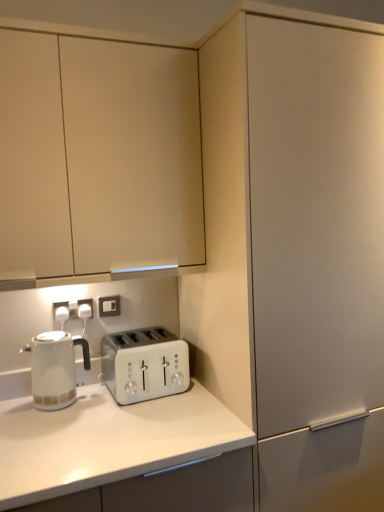
What do you see at coordinates (306, 246) in the screenshot? I see `matte white cabinet at center, placed as the second cabinetry when sorted from left to right` at bounding box center [306, 246].

The image size is (384, 512). What do you see at coordinates (109, 306) in the screenshot?
I see `white plastic electric outlet at upper center, the 2th electric outlet viewed from the left` at bounding box center [109, 306].

Looking at this image, measure the distance between point (61, 309) and camera.

Point (61, 309) is 1.62 meters away from camera.

Describe the element at coordinates (98, 155) in the screenshot. This screenshot has width=384, height=512. I see `matte white cabinet at upper left, which is the 1th cabinetry from left to right` at that location.

What do you see at coordinates (144, 364) in the screenshot? The image size is (384, 512). I see `white plastic toaster at center` at bounding box center [144, 364].

You are a GUI agent. You are given a task and a screenshot of the screen. Output one action in this format:
    pyautogui.click(x=<x>, y=<y>)
    Task: Click on the white glossy kettle at left
    
    Given the screenshot: What is the action you would take?
    pyautogui.click(x=55, y=368)

In order to click on matte white cabinet at center, placed as the second cabinetry when sorted from left to right in this screenshot , I will do `click(306, 246)`.

From a real-world perspective, who is located higher, white plastic electric outlet at lower left, the second electric outlet in the back-to-front sequence, or white plastic electric outlet at upper center, acting as the first electric outlet starting from the right?

white plastic electric outlet at upper center, acting as the first electric outlet starting from the right.

Is white plastic electric outlet at lower left, acting as the 1th electric outlet starting from the front, aimed at white plastic electric outlet at upper center, marked as the 1th electric outlet in a back-to-front arrangement?

No, white plastic electric outlet at lower left, acting as the 1th electric outlet starting from the front, is not oriented towards white plastic electric outlet at upper center, marked as the 1th electric outlet in a back-to-front arrangement.

Based on their positions, is white plastic electric outlet at lower left, arranged as the 2th electric outlet when viewed from the right, located to the left or right of white plastic electric outlet at upper center, the second electric outlet in the front-to-back sequence?

Clearly, white plastic electric outlet at lower left, arranged as the 2th electric outlet when viewed from the right, is on the left of white plastic electric outlet at upper center, the second electric outlet in the front-to-back sequence, in the image.

Is white plastic electric outlet at lower left, the second electric outlet in the back-to-front sequence, in contact with white plastic electric outlet at upper center, the second electric outlet in the front-to-back sequence?

No, white plastic electric outlet at lower left, the second electric outlet in the back-to-front sequence, is not touching white plastic electric outlet at upper center, the second electric outlet in the front-to-back sequence.

Is white glossy kettle at left wider or thinner than white plastic electric outlet at upper center, the second electric outlet in the front-to-back sequence?

white glossy kettle at left is wider than white plastic electric outlet at upper center, the second electric outlet in the front-to-back sequence.

Considering the relative positions of white glossy kettle at left and white plastic electric outlet at upper center, the second electric outlet in the front-to-back sequence, in the image provided, is white glossy kettle at left to the left of white plastic electric outlet at upper center, the second electric outlet in the front-to-back sequence, from the viewer's perspective?

Yes.

How many degrees apart are the facing directions of white glossy kettle at left and white plastic electric outlet at upper center, acting as the first electric outlet starting from the right?

There is a 3.14-degree angle between the facing directions of white glossy kettle at left and white plastic electric outlet at upper center, acting as the first electric outlet starting from the right.

Considering the relative sizes of white glossy kettle at left and white plastic electric outlet at upper center, the 2th electric outlet viewed from the left, in the image provided, is white glossy kettle at left shorter than white plastic electric outlet at upper center, the 2th electric outlet viewed from the left,?

Incorrect, the height of white glossy kettle at left does not fall short of that of white plastic electric outlet at upper center, the 2th electric outlet viewed from the left.

Between white plastic electric outlet at upper center, the 2th electric outlet viewed from the left, and matte white cabinet at center, placed as the second cabinetry when sorted from left to right, which one has smaller size?

With smaller size is white plastic electric outlet at upper center, the 2th electric outlet viewed from the left.

Considering the sizes of objects white plastic electric outlet at upper center, marked as the 1th electric outlet in a back-to-front arrangement, and matte white cabinet at center, positioned as the 1th cabinetry in right-to-left order, in the image provided, who is taller, white plastic electric outlet at upper center, marked as the 1th electric outlet in a back-to-front arrangement, or matte white cabinet at center, positioned as the 1th cabinetry in right-to-left order,?

Standing taller between the two is matte white cabinet at center, positioned as the 1th cabinetry in right-to-left order.

From the image's perspective, is white plastic electric outlet at upper center, marked as the 1th electric outlet in a back-to-front arrangement, over matte white cabinet at center, positioned as the 1th cabinetry in right-to-left order?

Yes, from the image's perspective, white plastic electric outlet at upper center, marked as the 1th electric outlet in a back-to-front arrangement, is on top of matte white cabinet at center, positioned as the 1th cabinetry in right-to-left order.

From a real-world perspective, between white plastic electric outlet at upper center, the 2th electric outlet viewed from the left, and matte white cabinet at center, placed as the second cabinetry when sorted from left to right, who is vertically higher?

In real-world perspective, white plastic electric outlet at upper center, the 2th electric outlet viewed from the left, is above.

Are white plastic electric outlet at upper center, the second electric outlet in the front-to-back sequence, and white plastic electric outlet at lower left, placed as the first electric outlet when sorted from left to right, far apart?

white plastic electric outlet at upper center, the second electric outlet in the front-to-back sequence, is actually quite close to white plastic electric outlet at lower left, placed as the first electric outlet when sorted from left to right.

From a real-world perspective, which is physically below, white plastic electric outlet at upper center, acting as the first electric outlet starting from the right, or white plastic electric outlet at lower left, acting as the 1th electric outlet starting from the front?

From a 3D spatial view, white plastic electric outlet at lower left, acting as the 1th electric outlet starting from the front, is below.

I want to click on electric outlet above the white plastic electric outlet at lower left, placed as the first electric outlet when sorted from left to right (from a real-world perspective), so click(x=109, y=306).

Considering the positions of point (99, 311) and point (62, 309), is point (99, 311) closer or farther from the camera than point (62, 309)?

Point (99, 311).

In the scene shown: From a real-world perspective, does matte white cabinet at center, placed as the second cabinetry when sorted from left to right, sit lower than white plastic electric outlet at upper center, the 2th electric outlet viewed from the left?

Correct, in the physical world, matte white cabinet at center, placed as the second cabinetry when sorted from left to right, is lower than white plastic electric outlet at upper center, the 2th electric outlet viewed from the left.

How different are the orientations of matte white cabinet at center, placed as the second cabinetry when sorted from left to right, and white plastic electric outlet at upper center, acting as the first electric outlet starting from the right, in degrees?

There is a 4.32-degree angle between the facing directions of matte white cabinet at center, placed as the second cabinetry when sorted from left to right, and white plastic electric outlet at upper center, acting as the first electric outlet starting from the right.

Is matte white cabinet at center, placed as the second cabinetry when sorted from left to right, in contact with white plastic electric outlet at upper center, the second electric outlet in the front-to-back sequence?

No, matte white cabinet at center, placed as the second cabinetry when sorted from left to right, is not next to white plastic electric outlet at upper center, the second electric outlet in the front-to-back sequence.

Measure the distance from matte white cabinet at center, positioned as the 1th cabinetry in right-to-left order, to white plastic electric outlet at upper center, the second electric outlet in the front-to-back sequence.

34.02 inches.

Is matte white cabinet at upper left, which is the 1th cabinetry from left to right, positioned far away from white glossy kettle at left?

No, matte white cabinet at upper left, which is the 1th cabinetry from left to right, is not far from white glossy kettle at left.

Is matte white cabinet at upper left, the 2th cabinetry viewed from the right, not within white glossy kettle at left?

Yes.

How different are the orientations of matte white cabinet at upper left, the 2th cabinetry viewed from the right, and white glossy kettle at left in degrees?

0.945 degrees separate the facing orientations of matte white cabinet at upper left, the 2th cabinetry viewed from the right, and white glossy kettle at left.

Considering the relative sizes of matte white cabinet at upper left, which is the 1th cabinetry from left to right, and white glossy kettle at left in the image provided, is matte white cabinet at upper left, which is the 1th cabinetry from left to right, wider than white glossy kettle at left?

Correct, the width of matte white cabinet at upper left, which is the 1th cabinetry from left to right, exceeds that of white glossy kettle at left.

From a real-world perspective, is white plastic toaster at center positioned under matte white cabinet at center, placed as the second cabinetry when sorted from left to right, based on gravity?

Yes, from a real-world perspective, white plastic toaster at center is beneath matte white cabinet at center, placed as the second cabinetry when sorted from left to right.

Could matte white cabinet at center, placed as the second cabinetry when sorted from left to right, be considered to be inside white plastic toaster at center?

No, white plastic toaster at center does not contain matte white cabinet at center, placed as the second cabinetry when sorted from left to right.

Measure the distance between white plastic toaster at center and matte white cabinet at center, placed as the second cabinetry when sorted from left to right.

They are 23.53 inches apart.

Considering the sizes of objects white plastic toaster at center and matte white cabinet at center, placed as the second cabinetry when sorted from left to right, in the image provided, who is taller, white plastic toaster at center or matte white cabinet at center, placed as the second cabinetry when sorted from left to right,?

Standing taller between the two is matte white cabinet at center, placed as the second cabinetry when sorted from left to right.

Where is `electric outlet above the white plastic electric outlet at lower left, arranged as the 2th electric outlet when viewed from the right (from a real-world perspective)`? electric outlet above the white plastic electric outlet at lower left, arranged as the 2th electric outlet when viewed from the right (from a real-world perspective) is located at coordinates pos(109,306).

Locate an element on the screen. electric outlet on the right of white glossy kettle at left is located at coordinates (109, 306).

Which object lies further to the anchor point white plastic electric outlet at upper center, the 2th electric outlet viewed from the left, matte white cabinet at center, placed as the second cabinetry when sorted from left to right, or white plastic toaster at center?

matte white cabinet at center, placed as the second cabinetry when sorted from left to right.

Which object lies nearer to the anchor point white plastic toaster at center, matte white cabinet at upper left, which is the 1th cabinetry from left to right, or white plastic electric outlet at lower left, acting as the 1th electric outlet starting from the front?

white plastic electric outlet at lower left, acting as the 1th electric outlet starting from the front, is positioned closer to the anchor white plastic toaster at center.

Looking at the image, which one is located further to matte white cabinet at center, positioned as the 1th cabinetry in right-to-left order, white plastic toaster at center or white plastic electric outlet at lower left, the second electric outlet in the back-to-front sequence?

white plastic electric outlet at lower left, the second electric outlet in the back-to-front sequence, is further to matte white cabinet at center, positioned as the 1th cabinetry in right-to-left order.

When comparing their distances from matte white cabinet at upper left, which is the 1th cabinetry from left to right, does matte white cabinet at center, positioned as the 1th cabinetry in right-to-left order, or white plastic electric outlet at upper center, the 2th electric outlet viewed from the left, seem closer?

matte white cabinet at center, positioned as the 1th cabinetry in right-to-left order, is positioned closer to the anchor matte white cabinet at upper left, which is the 1th cabinetry from left to right.

Considering their positions, is white plastic electric outlet at upper center, the second electric outlet in the front-to-back sequence, positioned further to white glossy kettle at left than matte white cabinet at upper left, the 2th cabinetry viewed from the right?

Among the two, matte white cabinet at upper left, the 2th cabinetry viewed from the right, is located further to white glossy kettle at left.

Which object lies further to the anchor point white plastic electric outlet at lower left, arranged as the 2th electric outlet when viewed from the right, white glossy kettle at left or matte white cabinet at center, positioned as the 1th cabinetry in right-to-left order?

Among the two, matte white cabinet at center, positioned as the 1th cabinetry in right-to-left order, is located further to white plastic electric outlet at lower left, arranged as the 2th electric outlet when viewed from the right.

Considering their positions, is white plastic toaster at center positioned further to white glossy kettle at left than white plastic electric outlet at lower left, arranged as the 2th electric outlet when viewed from the right?

white plastic toaster at center is further to white glossy kettle at left.

Looking at this image, estimate the real-world distances between objects in this image. Which object is further from white plastic electric outlet at upper center, the 2th electric outlet viewed from the left, matte white cabinet at upper left, which is the 1th cabinetry from left to right, or white plastic toaster at center?

matte white cabinet at upper left, which is the 1th cabinetry from left to right, lies further to white plastic electric outlet at upper center, the 2th electric outlet viewed from the left, than the other object.

The width and height of the screenshot is (384, 512). In order to click on toaster positioned between white glossy kettle at left and white plastic electric outlet at upper center, the 2th electric outlet viewed from the left, from near to far in this screenshot , I will do `click(144, 364)`.

Image resolution: width=384 pixels, height=512 pixels. Find the location of `home appliance located between white plastic electric outlet at lower left, placed as the first electric outlet when sorted from left to right, and matte white cabinet at center, placed as the second cabinetry when sorted from left to right, in the left-right direction`. home appliance located between white plastic electric outlet at lower left, placed as the first electric outlet when sorted from left to right, and matte white cabinet at center, placed as the second cabinetry when sorted from left to right, in the left-right direction is located at coordinates (55, 368).

What are the coordinates of `electric outlet between white glossy kettle at left and white plastic electric outlet at upper center, the second electric outlet in the front-to-back sequence, in the front-back direction` in the screenshot? It's located at click(61, 312).

The height and width of the screenshot is (512, 384). In order to click on electric outlet between matte white cabinet at upper left, the 2th cabinetry viewed from the right, and matte white cabinet at center, placed as the second cabinetry when sorted from left to right in this screenshot , I will do `click(109, 306)`.